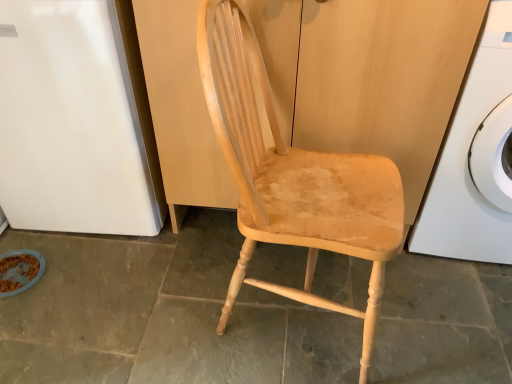
Where is `vacant space that is in between natural wood chair at center and brown crumbly food at lower left`? This screenshot has height=384, width=512. vacant space that is in between natural wood chair at center and brown crumbly food at lower left is located at coordinates (132, 299).